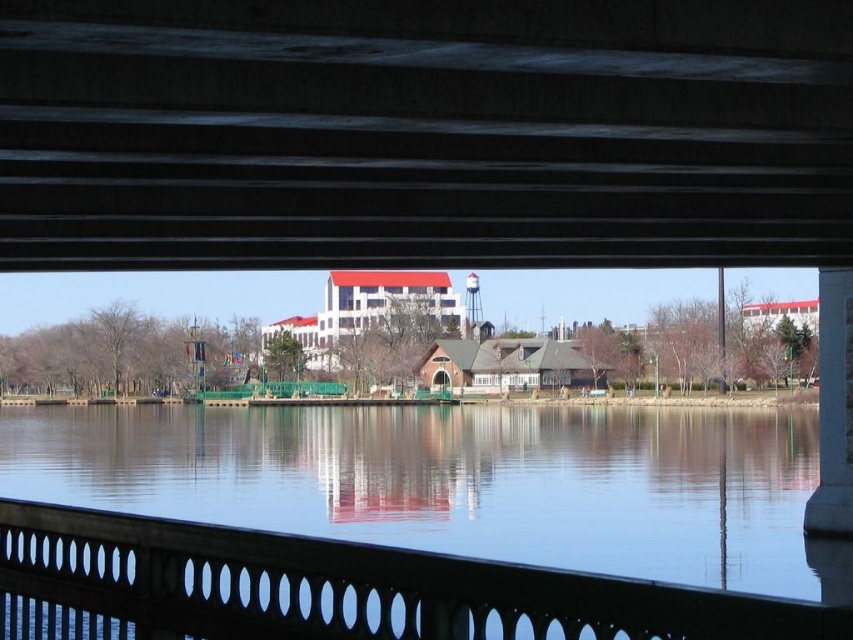
You are standing at the point marked as point (520, 26) under the bridge. A friend is waiting for you at the exact location where you are currently standing. If you walk straight towards the nearest large white building in the background, how far will you have to walk before reaching the point where your friend is waiting?

You don not need to walk any distance because your friend is waiting at the same location where you are currently standing at point (520, 26).

You are standing under the bridge and looking out over the water. You notice two points marked in the scene. The first point is at coordinate point (689, 77) and the second is at point (450, 632). Which point is closer to your eyes?

Point (689, 77) is further to the camera than point (450, 632), so the point closer to your eyes is point (450, 632).